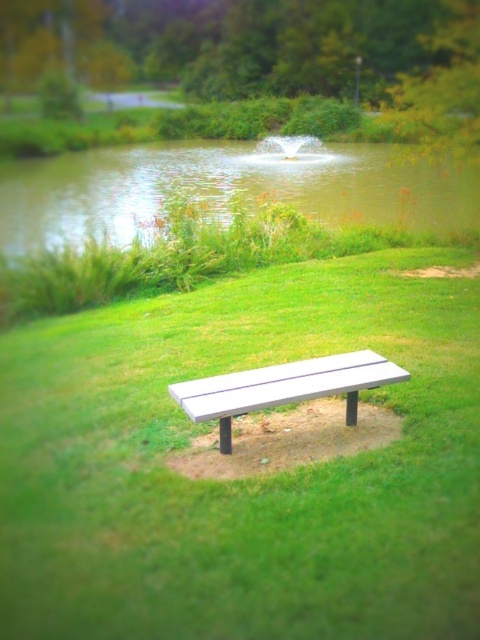
You are standing at the point marked as point [238,42] in the park. What can you see directly in front of you?

At point [238,42] lies green leafy tree at center, so you can see the green leafy tree at center directly in front of you.